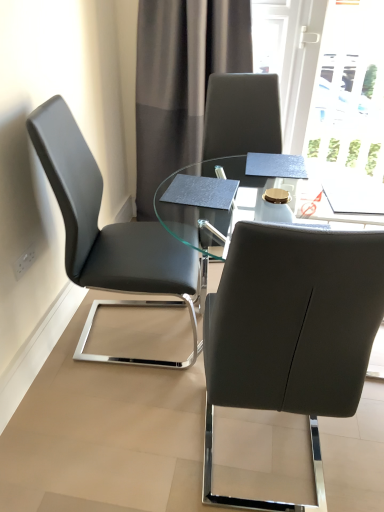
The height and width of the screenshot is (512, 384). Find the location of `vacant space underneath matte black chair at center, the first chair when ordered from right to left (from a real-world perspective)`. vacant space underneath matte black chair at center, the first chair when ordered from right to left (from a real-world perspective) is located at coordinates (260, 462).